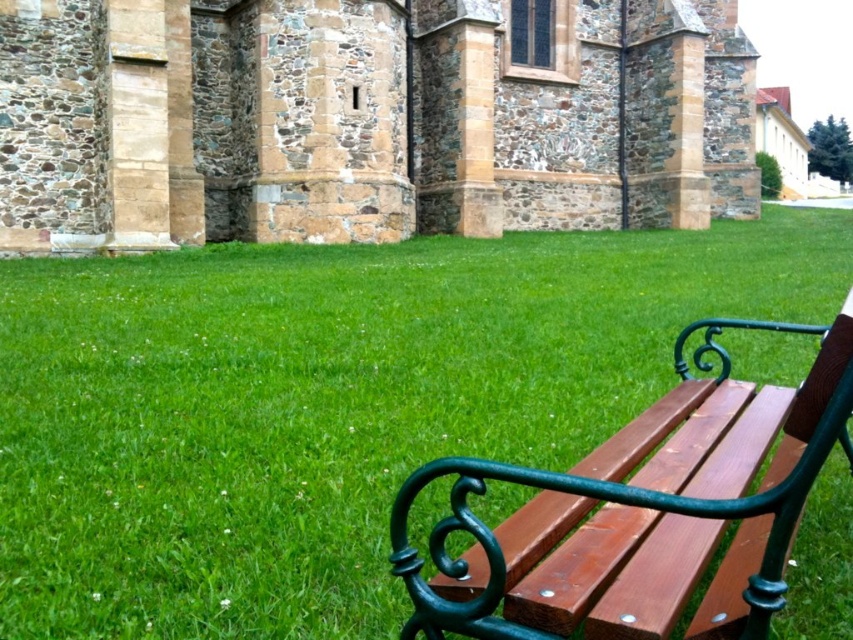
You are standing at the point with coordinates (366, 120) in the scene. What is the object located exactly at that point?

The object located exactly at point (366, 120) is the stone textured church at center.

You are standing at the origin point of the coordinate system in the image. You want to walk towards the green grass at center. Which direction should you move in terms of x and y coordinates?

The green grass at center is located at coordinates point (328, 404), so you should move in the positive x and positive y direction to reach it.

Consider the image. You are standing in the middle of the lawn and see the green grass at center and the stone textured church at center. Which object is closer to you?

The green grass at center is closer to you since it is positioned below the stone textured church at center, indicating it is in the foreground.